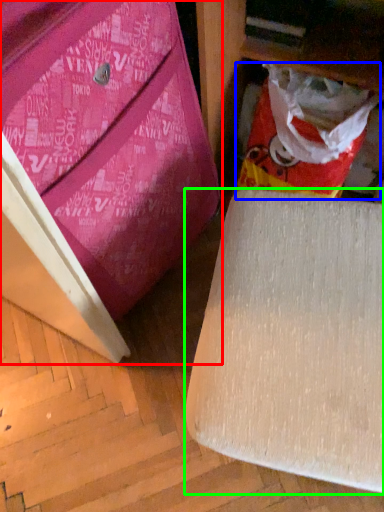
Question: Estimate the real-world distances between objects in this image. Which object is closer to furniture (highlighted by a red box), shopping bag (highlighted by a blue box) or furniture (highlighted by a green box)?

Choices:
 (A) shopping bag
 (B) furniture

Answer: (B)